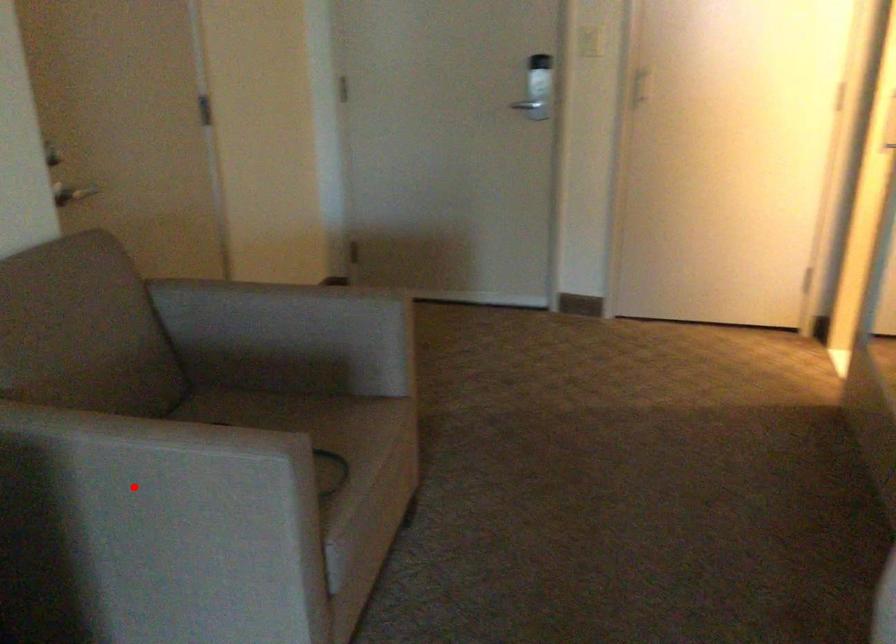
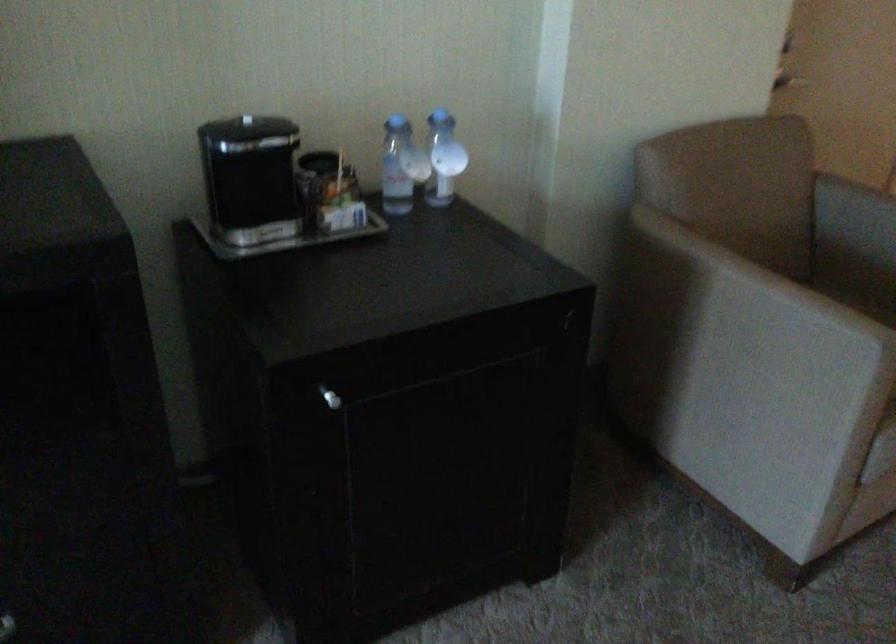
Where in the second image is the point corresponding to the highlighted location from the first image?

(739, 319)